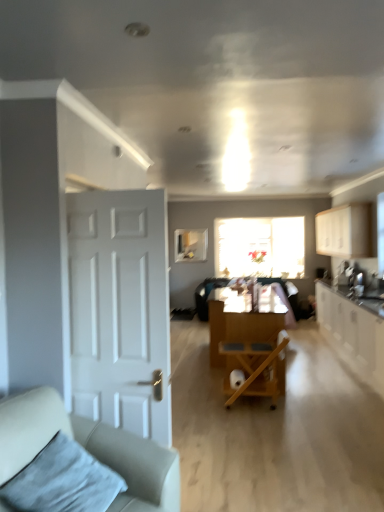
Question: Considering the relative sizes of wooden folding chair at center and white glossy cabinets at right, placed as the second cabinetry when sorted from top to bottom, in the image provided, is wooden folding chair at center shorter than white glossy cabinets at right, placed as the second cabinetry when sorted from top to bottom,?

Choices:
 (A) yes
 (B) no

Answer: (A)

Question: Can you confirm if wooden folding chair at center is thinner than white glossy cabinets at right, which is counted as the 1th cabinetry, starting from the bottom?

Choices:
 (A) no
 (B) yes

Answer: (B)

Question: Are wooden folding chair at center and white glossy cabinets at right, which is counted as the 1th cabinetry, starting from the bottom, beside each other?

Choices:
 (A) no
 (B) yes

Answer: (A)

Question: Is wooden folding chair at center positioned far away from white glossy cabinets at right, placed as the second cabinetry when sorted from top to bottom?

Choices:
 (A) no
 (B) yes

Answer: (B)

Question: Considering the relative sizes of wooden folding chair at center and white glossy cabinets at right, which is counted as the 1th cabinetry, starting from the bottom, in the image provided, is wooden folding chair at center wider than white glossy cabinets at right, which is counted as the 1th cabinetry, starting from the bottom,?

Choices:
 (A) no
 (B) yes

Answer: (A)

Question: Considering the positions of point (256, 266) and point (230, 391), is point (256, 266) closer or farther from the camera than point (230, 391)?

Choices:
 (A) farther
 (B) closer

Answer: (A)

Question: Considering their positions, is translucent glass window at center located in front of or behind wooden folding chair at center?

Choices:
 (A) front
 (B) behind

Answer: (B)

Question: Is translucent glass window at center wider or thinner than wooden folding chair at center?

Choices:
 (A) thin
 (B) wide

Answer: (A)

Question: Based on their sizes in the image, would you say translucent glass window at center is bigger or smaller than wooden folding chair at center?

Choices:
 (A) small
 (B) big

Answer: (B)

Question: Looking at their shapes, would you say wooden cart at center is wider or thinner than translucent glass window at center?

Choices:
 (A) thin
 (B) wide

Answer: (B)

Question: From a real-world perspective, is wooden cart at center positioned above or below translucent glass window at center?

Choices:
 (A) above
 (B) below

Answer: (B)

Question: Is point (220, 354) positioned closer to the camera than point (230, 265)?

Choices:
 (A) closer
 (B) farther

Answer: (A)

Question: Would you say wooden cart at center is inside or outside translucent glass window at center?

Choices:
 (A) inside
 (B) outside

Answer: (B)

Question: Relative to white matte door at left, is white matte cabinet at upper right, which is the second cabinetry from bottom to top, in front or behind?

Choices:
 (A) behind
 (B) front

Answer: (A)

Question: Considering the positions of white matte cabinet at upper right, which is the second cabinetry from bottom to top, and white matte door at left in the image, is white matte cabinet at upper right, which is the second cabinetry from bottom to top, taller or shorter than white matte door at left?

Choices:
 (A) tall
 (B) short

Answer: (B)